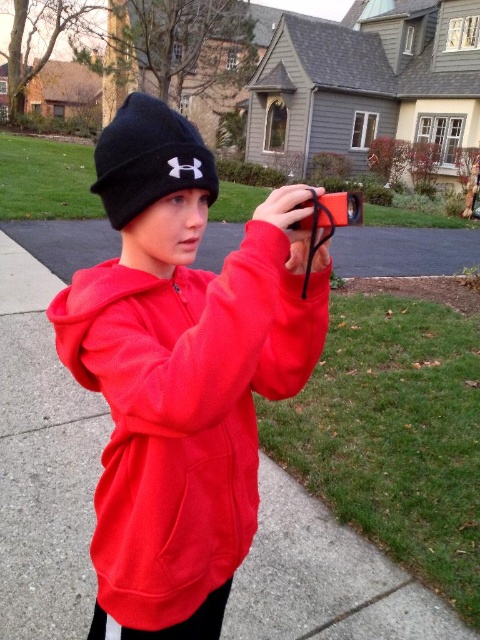
You are a photographer standing on the sidewalk and want to take a photo of two points marked in the image. The first point is at coordinates point (96, 305) and the second point is at point (140, 132). Based on their positions, which point will appear closer to the camera in the final photo?

Point (96, 305) is further to the camera than point (140, 132), so in the photo, point (96, 305) will appear closer to the camera than point (140, 132).

You are a fashion designer observing the person in the image. You need to describe the position of the matte red hoodie at center relative to the black knit beanie at upper center without looking at the image. How would you describe their positioning?

The matte red hoodie at center is positioned to the right of the black knit beanie at upper center.

You are a fashion designer observing the person in the scene. Which clothing item is positioned higher on their body, the matte red hoodie at center or the black knit beanie at upper center?

The black knit beanie at upper center is positioned higher on their body than the matte red hoodie at center.